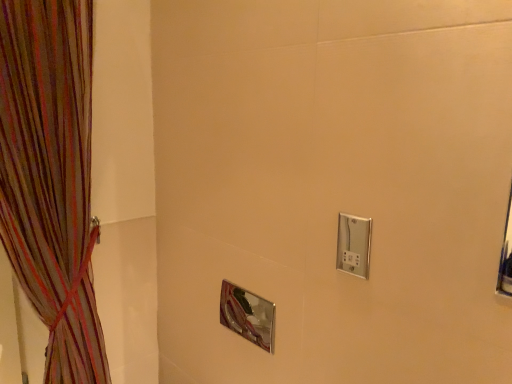
This screenshot has width=512, height=384. What do you see at coordinates (51, 177) in the screenshot? I see `multicolored sheer curtain at left` at bounding box center [51, 177].

Find the location of a particular element. The height and width of the screenshot is (384, 512). multicolored sheer curtain at left is located at coordinates (51, 177).

What are the coordinates of `curtain on the left of satin nickel switch at upper right` in the screenshot? It's located at (51, 177).

From the picture: Between multicolored sheer curtain at left and satin nickel switch at upper right, which one appears on the left side from the viewer's perspective?

Positioned to the left is multicolored sheer curtain at left.

Which of these two, multicolored sheer curtain at left or satin nickel switch at upper right, is thinner?

satin nickel switch at upper right is thinner.

Considering the relative sizes of multicolored sheer curtain at left and satin nickel switch at upper right in the image provided, is multicolored sheer curtain at left smaller than satin nickel switch at upper right?

Actually, multicolored sheer curtain at left might be larger than satin nickel switch at upper right.

Between point (349, 224) and point (66, 326), which one is positioned behind?

The point (66, 326) is more distant.

Identify the location of curtain directly beneath the satin nickel switch at upper right (from a real-world perspective). (51, 177).

In terms of width, does satin nickel switch at upper right look wider or thinner when compared to multicolored sheer curtain at left?

Clearly, satin nickel switch at upper right has less width compared to multicolored sheer curtain at left.

Can you tell me how much satin nickel switch at upper right and multicolored sheer curtain at left differ in facing direction?

The angle between the facing direction of satin nickel switch at upper right and the facing direction of multicolored sheer curtain at left is 91.5 degrees.

Could you tell me if polished chrome mirror at center is turned towards satin nickel switch at upper right?

No, polished chrome mirror at center does not turn towards satin nickel switch at upper right.

Between polished chrome mirror at center and satin nickel switch at upper right, which one appears on the left side from the viewer's perspective?

From the viewer's perspective, polished chrome mirror at center appears more on the left side.

Which is further, [227,317] or [339,221]?

Point [227,317]

Considering the sizes of objects multicolored sheer curtain at left and polished chrome mirror at center in the image provided, who is shorter, multicolored sheer curtain at left or polished chrome mirror at center?

polished chrome mirror at center.

From a real-world perspective, is multicolored sheer curtain at left positioned above or below polished chrome mirror at center?

From a real-world perspective, multicolored sheer curtain at left is physically above polished chrome mirror at center.

Can you confirm if multicolored sheer curtain at left is thinner than polished chrome mirror at center?

Incorrect, the width of multicolored sheer curtain at left is not less than that of polished chrome mirror at center.

Is multicolored sheer curtain at left closer to camera compared to polished chrome mirror at center?

Yes.

Can multicolored sheer curtain at left be found inside polished chrome mirror at center?

No.

Does polished chrome mirror at center have a smaller size compared to multicolored sheer curtain at left?

Indeed, polished chrome mirror at center has a smaller size compared to multicolored sheer curtain at left.

Is polished chrome mirror at center in front of or behind multicolored sheer curtain at left in the image?

Clearly, polished chrome mirror at center is behind multicolored sheer curtain at left.

Which object is more forward, satin nickel switch at upper right or polished chrome mirror at center?

Positioned in front is satin nickel switch at upper right.

Where is `mirror on the left side of satin nickel switch at upper right`? mirror on the left side of satin nickel switch at upper right is located at coordinates (248, 315).

From a real-world perspective, which object stands above the other?

In real-world perspective, satin nickel switch at upper right is above.

Considering the sizes of objects satin nickel switch at upper right and polished chrome mirror at center in the image provided, who is thinner, satin nickel switch at upper right or polished chrome mirror at center?

satin nickel switch at upper right is thinner.

Where is `light switch behind the multicolored sheer curtain at left`? This screenshot has height=384, width=512. light switch behind the multicolored sheer curtain at left is located at coordinates (354, 245).

Locate an element on the screen. The width and height of the screenshot is (512, 384). curtain in front of the satin nickel switch at upper right is located at coordinates (51, 177).

From the image, which object appears to be nearer to multicolored sheer curtain at left, polished chrome mirror at center or satin nickel switch at upper right?

Based on the image, polished chrome mirror at center appears to be nearer to multicolored sheer curtain at left.

From the image, which object appears to be nearer to polished chrome mirror at center, multicolored sheer curtain at left or satin nickel switch at upper right?

satin nickel switch at upper right is positioned closer to the anchor polished chrome mirror at center.

Looking at the image, which one is located further to polished chrome mirror at center, satin nickel switch at upper right or multicolored sheer curtain at left?

Based on the image, multicolored sheer curtain at left appears to be further to polished chrome mirror at center.

Looking at the image, which one is located closer to satin nickel switch at upper right, multicolored sheer curtain at left or polished chrome mirror at center?

Among the two, polished chrome mirror at center is located nearer to satin nickel switch at upper right.

Based on their spatial positions, is satin nickel switch at upper right or polished chrome mirror at center closer to multicolored sheer curtain at left?

Based on the image, polished chrome mirror at center appears to be nearer to multicolored sheer curtain at left.

Considering their positions, is polished chrome mirror at center positioned closer to satin nickel switch at upper right than multicolored sheer curtain at left?

Based on the image, polished chrome mirror at center appears to be nearer to satin nickel switch at upper right.

This screenshot has height=384, width=512. Find the location of `mirror between multicolored sheer curtain at left and satin nickel switch at upper right`. mirror between multicolored sheer curtain at left and satin nickel switch at upper right is located at coordinates (248, 315).